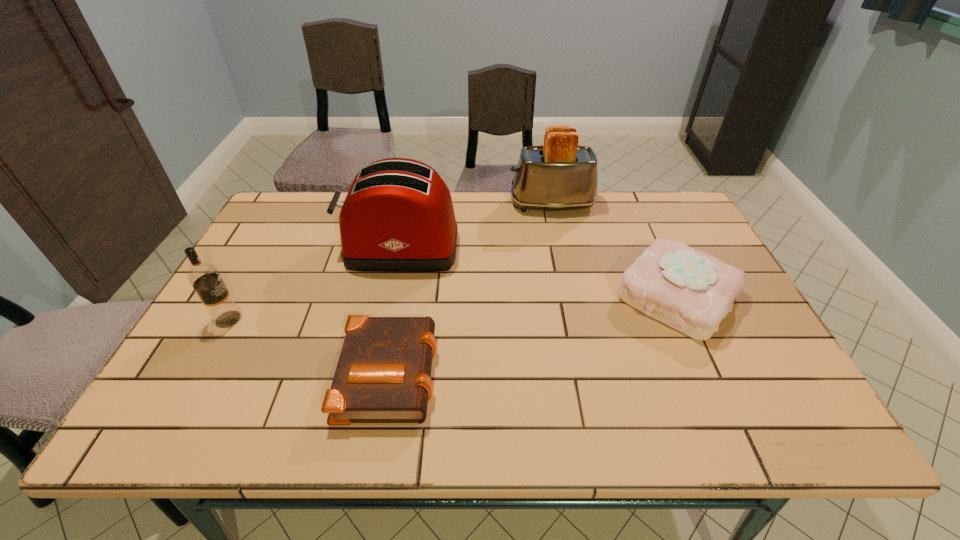
Find the location of `the farthest object`. the farthest object is located at coordinates (560, 175).

Locate an element on the screen. The image size is (960, 540). the right toaster is located at coordinates (560, 175).

Where is `the left toaster`? This screenshot has height=540, width=960. the left toaster is located at coordinates (398, 216).

Find the location of a particular element. This screenshot has height=540, width=960. the leftmost object is located at coordinates (205, 278).

Where is `the fourth tallest object`? the fourth tallest object is located at coordinates (691, 291).

The image size is (960, 540). Find the location of `the shortest object`. the shortest object is located at coordinates (383, 373).

The image size is (960, 540). I want to click on vacant area situated 0.360m on the side of the right toaster with the control lever, so click(398, 205).

Identify the location of blank space located on the side of the right toaster with the control lever. The height and width of the screenshot is (540, 960). (411, 205).

Identify the location of free point located 0.190m on the side of the right toaster with the control lever. The width and height of the screenshot is (960, 540). (451, 205).

Find the location of a particular element. vacant region located 0.190m on the front of the nearer toaster is located at coordinates (384, 326).